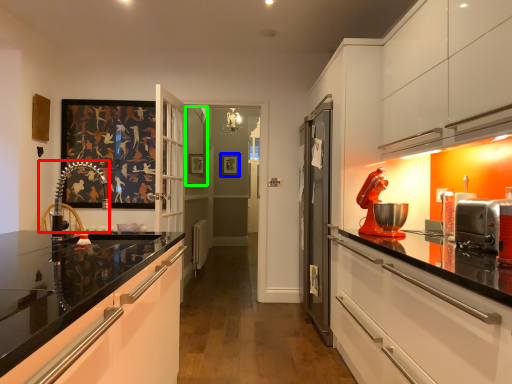
Question: Based on their relative distances, which object is farther from chair (highlighted by a red box)? Choose from picture frame (highlighted by a blue box) and window (highlighted by a green box).

Choices:
 (A) picture frame
 (B) window

Answer: (A)